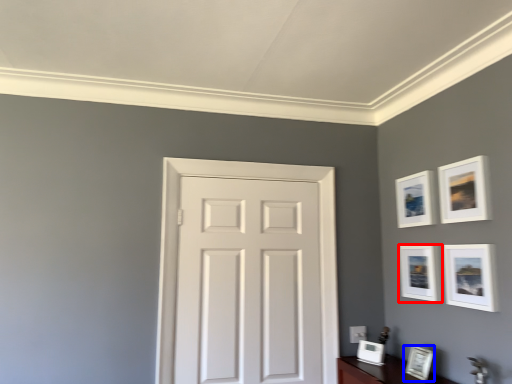
Question: Which point is closer to the camera, picture frame (highlighted by a red box) or picture frame (highlighted by a blue box)?

Choices:
 (A) picture frame
 (B) picture frame

Answer: (B)